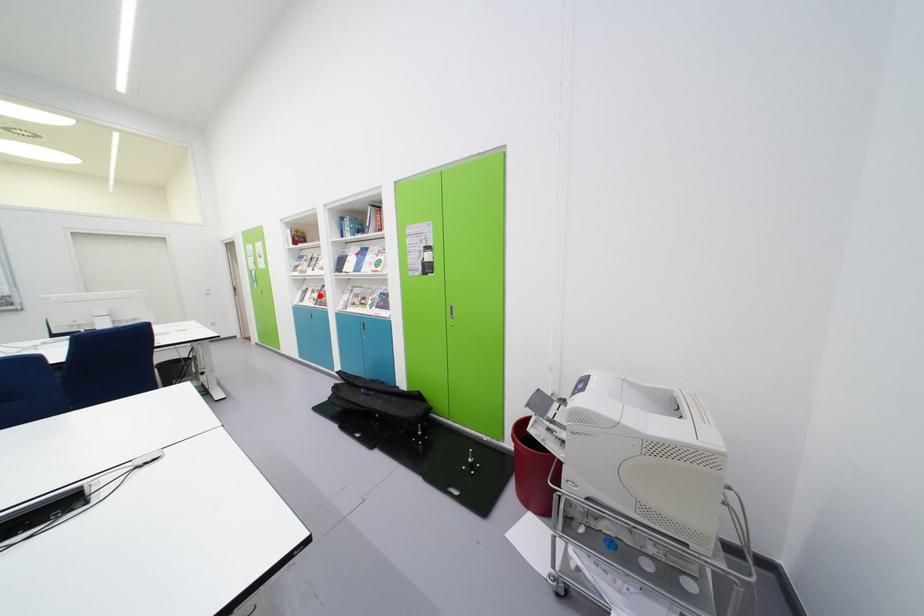
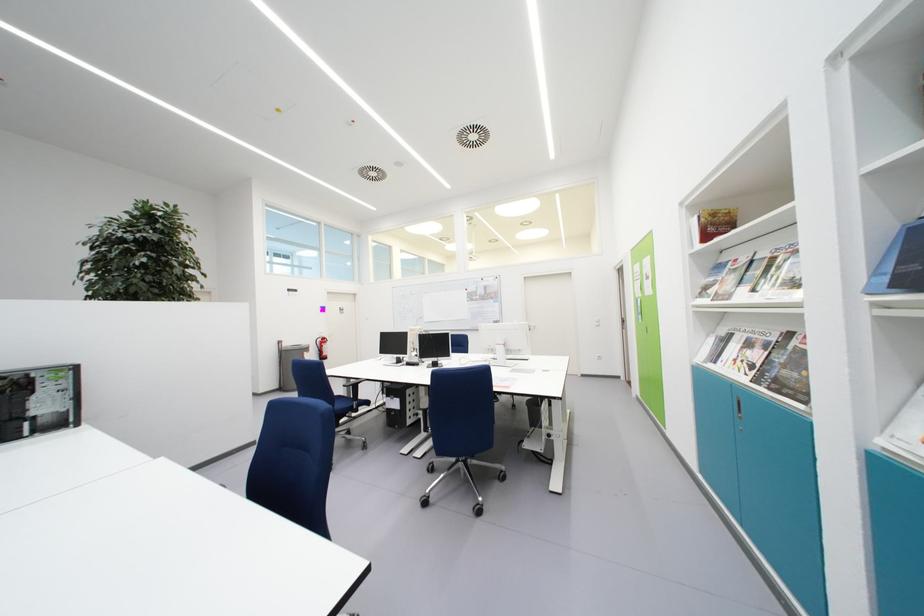
Where in the second image is the point corresponding to the highlighted location from the first image?

(755, 349)